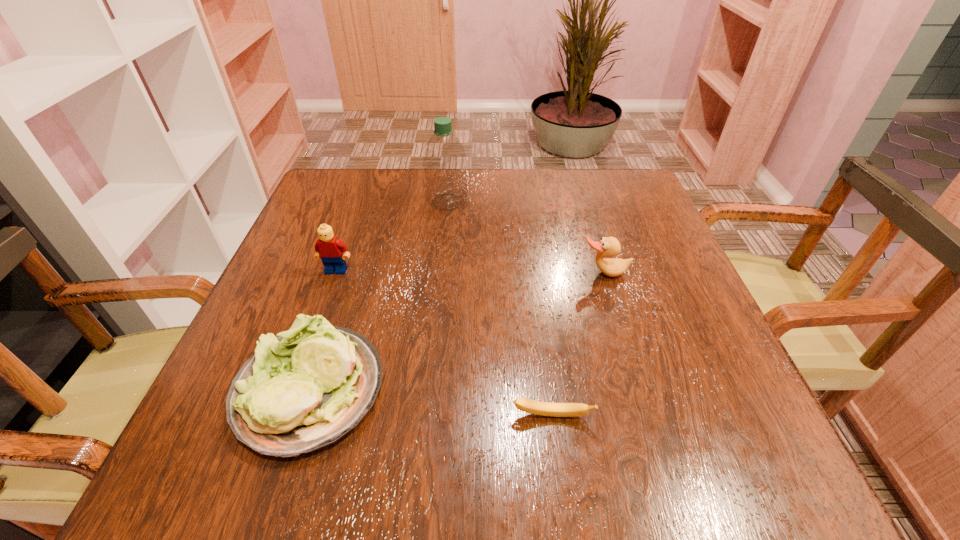
Where is `vacant space positioned 0.270m on the right of the lettuce`? vacant space positioned 0.270m on the right of the lettuce is located at coordinates (553, 391).

This screenshot has height=540, width=960. What are the coordinates of `free space located at the stem of the banana` in the screenshot? It's located at (558, 456).

Where is `object that is at the far edge`? This screenshot has width=960, height=540. object that is at the far edge is located at coordinates (444, 161).

Locate an element on the screen. Image resolution: width=960 pixels, height=540 pixels. object that is at the near edge is located at coordinates (304, 389).

In order to click on Lego that is at the left edge in this screenshot , I will do `click(329, 248)`.

Locate an element on the screen. lettuce located at the left edge is located at coordinates (304, 389).

Find the location of a particular element. object at the right edge is located at coordinates (608, 247).

The width and height of the screenshot is (960, 540). Find the location of `object situated at the near left corner`. object situated at the near left corner is located at coordinates (304, 389).

Where is `vacant space at the far edge of the desktop`? The width and height of the screenshot is (960, 540). vacant space at the far edge of the desktop is located at coordinates (569, 197).

Identify the location of vacant region at the near edge of the desktop. This screenshot has height=540, width=960. (359, 441).